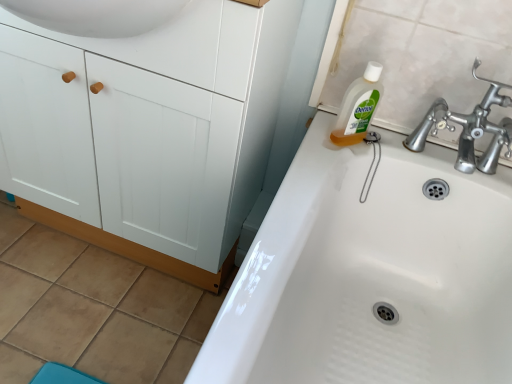
Question: Can you confirm if white matte cabinet at left is shorter than clear liquid soap at upper right?

Choices:
 (A) no
 (B) yes

Answer: (A)

Question: From a real-world perspective, is white matte cabinet at left beneath clear liquid soap at upper right?

Choices:
 (A) no
 (B) yes

Answer: (B)

Question: From the image's perspective, does white matte cabinet at left appear lower than clear liquid soap at upper right?

Choices:
 (A) no
 (B) yes

Answer: (B)

Question: Can you confirm if white matte cabinet at left is thinner than clear liquid soap at upper right?

Choices:
 (A) yes
 (B) no

Answer: (B)

Question: Could you tell me if white matte cabinet at left is turned towards clear liquid soap at upper right?

Choices:
 (A) yes
 (B) no

Answer: (B)

Question: Does white matte cabinet at left have a smaller size compared to clear liquid soap at upper right?

Choices:
 (A) yes
 (B) no

Answer: (B)

Question: Does white matte cabinet at left have a greater width compared to white glossy sink at upper right?

Choices:
 (A) no
 (B) yes

Answer: (A)

Question: Can we say white matte cabinet at left lies outside white glossy sink at upper right?

Choices:
 (A) no
 (B) yes

Answer: (B)

Question: Is white matte cabinet at left aimed at white glossy sink at upper right?

Choices:
 (A) yes
 (B) no

Answer: (B)

Question: Are white matte cabinet at left and white glossy sink at upper right making contact?

Choices:
 (A) no
 (B) yes

Answer: (A)

Question: Is white matte cabinet at left looking in the opposite direction of white glossy sink at upper right?

Choices:
 (A) yes
 (B) no

Answer: (B)

Question: From the image's perspective, is white matte cabinet at left over white glossy sink at upper right?

Choices:
 (A) yes
 (B) no

Answer: (A)

Question: Is white glossy sink at upper right in front of white matte cabinet at left?

Choices:
 (A) no
 (B) yes

Answer: (B)